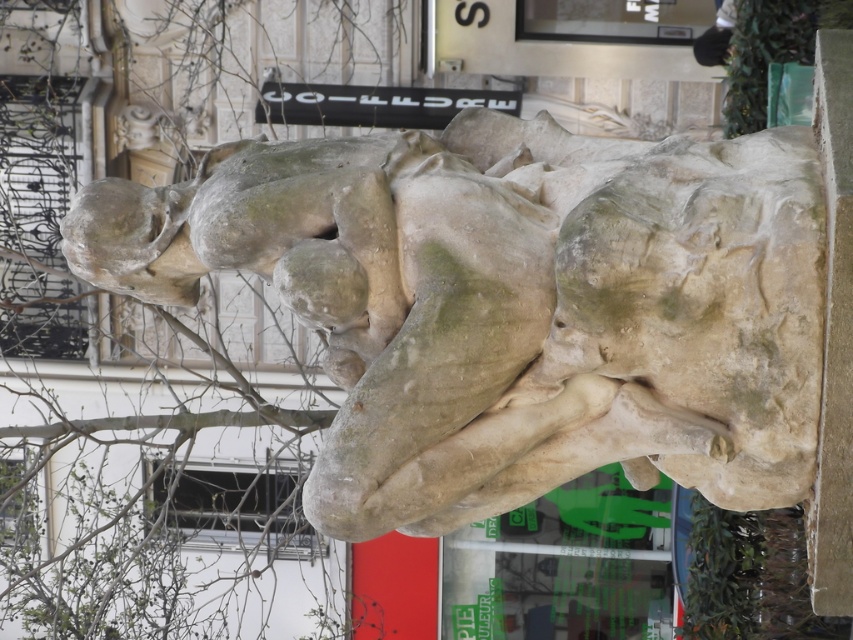
You are an art student analyzing the statue and its coordinates. You observe two points on the statue labeled as point (412, 371) and point (341, 307). Which point is positioned closer to your viewpoint?

Point (412, 371) is closer to the viewer than point (341, 307).

You are an art student analyzing the sculpture garden. You observe the stone statue at center and the stone head at upper left. Which object takes up more visual space in the image?

The stone statue at center takes up more visual space in the image because it is larger in size than the stone head at upper left.